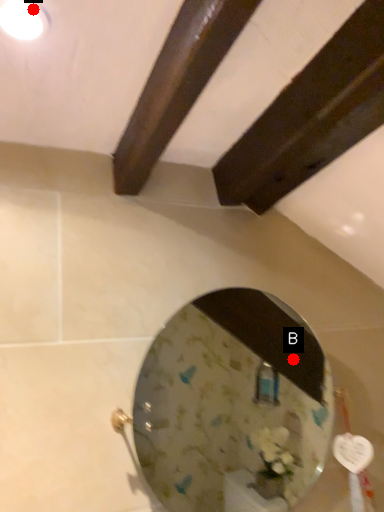
Question: Two points are circled on the image, labeled by A and B beside each circle. Which point is closer to the camera?

Choices:
 (A) A is closer
 (B) B is closer

Answer: (A)